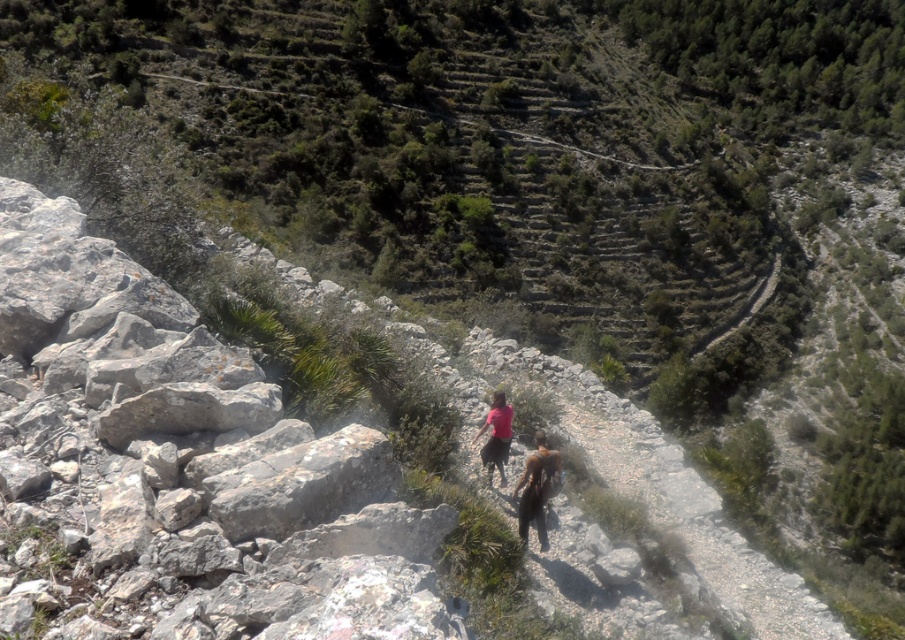
Looking at this image, does gray rough rock at left appear under dark brown leather jacket at center?

No.

Can you confirm if gray rough rock at left is thinner than dark brown leather jacket at center?

No, gray rough rock at left is not thinner than dark brown leather jacket at center.

The width and height of the screenshot is (905, 640). Describe the element at coordinates (186, 465) in the screenshot. I see `gray rough rock at left` at that location.

Where is `gray rough rock at left`? This screenshot has height=640, width=905. gray rough rock at left is located at coordinates (186, 465).

Does dark brown leather jacket at center have a greater height compared to matte pink shirt at center?

Correct, dark brown leather jacket at center is much taller as matte pink shirt at center.

Does dark brown leather jacket at center appear over matte pink shirt at center?

Incorrect, dark brown leather jacket at center is not positioned above matte pink shirt at center.

Where is `dark brown leather jacket at center`? This screenshot has height=640, width=905. dark brown leather jacket at center is located at coordinates (536, 488).

Does gray rough rock at left come behind matte pink shirt at center?

No, it is not.

Between gray rough rock at left and matte pink shirt at center, which one has less height?

With less height is gray rough rock at left.

You are a GUI agent. You are given a task and a screenshot of the screen. Output one action in this format:
    pyautogui.click(x=<x>, y=<y>)
    Task: Click on the gray rough rock at left
    The height and width of the screenshot is (640, 905).
    Given the screenshot: What is the action you would take?
    pyautogui.click(x=186, y=465)